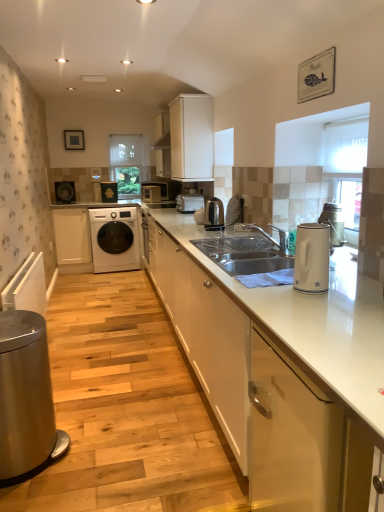
Where is `unoccupied space behind satin nickel kettle at center, the 1th appliance in the right-to-left sequence`? unoccupied space behind satin nickel kettle at center, the 1th appliance in the right-to-left sequence is located at coordinates (208, 226).